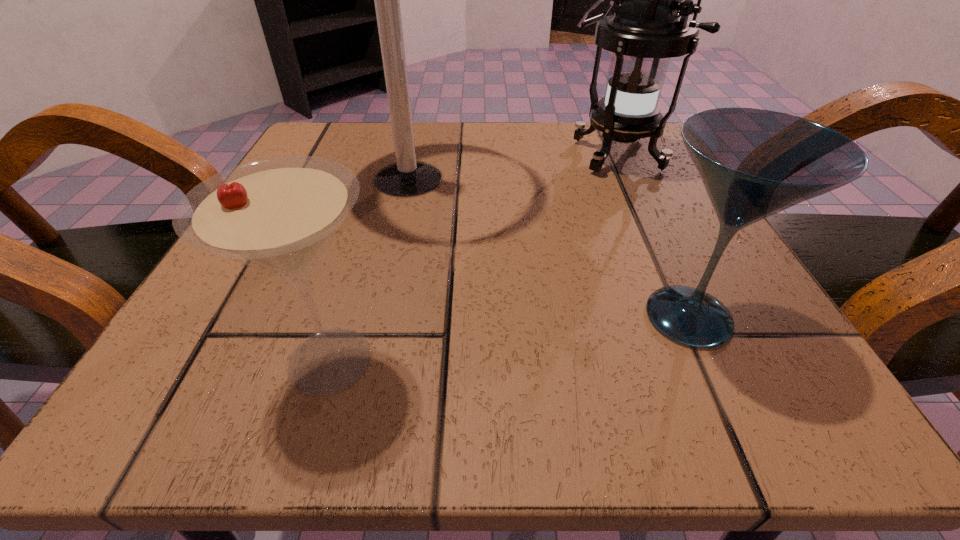
Where is `the tallest object`? the tallest object is located at coordinates (407, 177).

Where is `the third shortest object`? the third shortest object is located at coordinates (650, 25).

In order to click on the right martini in this screenshot , I will do `click(754, 163)`.

You are a GUI agent. You are given a task and a screenshot of the screen. Output one action in this format:
    pyautogui.click(x=<x>, y=<y>)
    Task: Click on the left martini
    The width and height of the screenshot is (960, 540).
    Given the screenshot: What is the action you would take?
    pyautogui.click(x=278, y=214)

Find the location of a particular element. The width and height of the screenshot is (960, 540). vacant space located on the front of the table lamp is located at coordinates [372, 343].

Locate an element on the screen. This screenshot has width=960, height=540. vacant space located 0.080m on the left of the lantern is located at coordinates (522, 154).

Where is `free space located on the left of the right martini`? Image resolution: width=960 pixels, height=540 pixels. free space located on the left of the right martini is located at coordinates (516, 317).

Find the location of a particular element. This screenshot has height=540, width=960. free space located 0.120m on the left of the left martini is located at coordinates [x=162, y=360].

The width and height of the screenshot is (960, 540). I want to click on table lamp that is at the far edge, so click(407, 177).

The height and width of the screenshot is (540, 960). In order to click on lantern present at the far edge in this screenshot , I will do `click(650, 25)`.